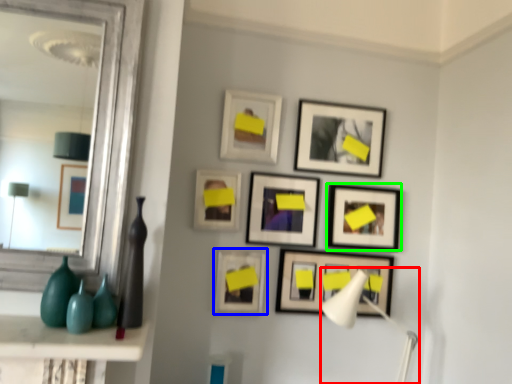
Question: Which object is positioned closest to table lamp (highlighted by a red box)? Select from picture frame (highlighted by a blue box) and picture frame (highlighted by a green box).

Choices:
 (A) picture frame
 (B) picture frame

Answer: (B)